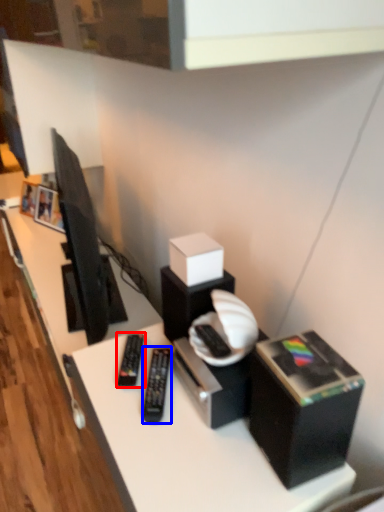
Question: Which object is further to the camera taking this photo, equipment (highlighted by a red box) or equipment (highlighted by a blue box)?

Choices:
 (A) equipment
 (B) equipment

Answer: (A)